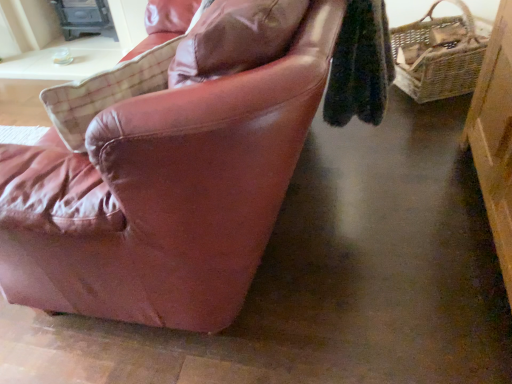
Question: Should I look upward or downward to see woven brown picnic basket at right?

Choices:
 (A) up
 (B) down

Answer: (A)

Question: Is leather chair at left at the left side of woven brown picnic basket at right?

Choices:
 (A) no
 (B) yes

Answer: (B)

Question: Is leather chair at left shorter than woven brown picnic basket at right?

Choices:
 (A) yes
 (B) no

Answer: (A)

Question: From the image's perspective, is leather chair at left on woven brown picnic basket at right?

Choices:
 (A) no
 (B) yes

Answer: (A)

Question: Could you tell me if leather chair at left is facing woven brown picnic basket at right?

Choices:
 (A) no
 (B) yes

Answer: (A)

Question: Considering the relative sizes of leather chair at left and woven brown picnic basket at right in the image provided, is leather chair at left taller than woven brown picnic basket at right?

Choices:
 (A) no
 (B) yes

Answer: (A)

Question: Can you confirm if leather chair at left is bigger than woven brown picnic basket at right?

Choices:
 (A) yes
 (B) no

Answer: (A)

Question: Is woven brown picnic basket at right directly adjacent to leather chair at left?

Choices:
 (A) no
 (B) yes

Answer: (A)

Question: Is woven brown picnic basket at right looking in the opposite direction of leather chair at left?

Choices:
 (A) no
 (B) yes

Answer: (A)

Question: Is woven brown picnic basket at right oriented towards leather chair at left?

Choices:
 (A) no
 (B) yes

Answer: (B)

Question: From a real-world perspective, is woven brown picnic basket at right under leather chair at left?

Choices:
 (A) no
 (B) yes

Answer: (A)

Question: Is woven brown picnic basket at right far from leather chair at left?

Choices:
 (A) no
 (B) yes

Answer: (B)

Question: Is woven brown picnic basket at right completely or partially outside of leather chair at left?

Choices:
 (A) no
 (B) yes

Answer: (B)

Question: Considering their positions, is leather chair at left located in front of or behind woven brown picnic basket at right?

Choices:
 (A) behind
 (B) front

Answer: (B)